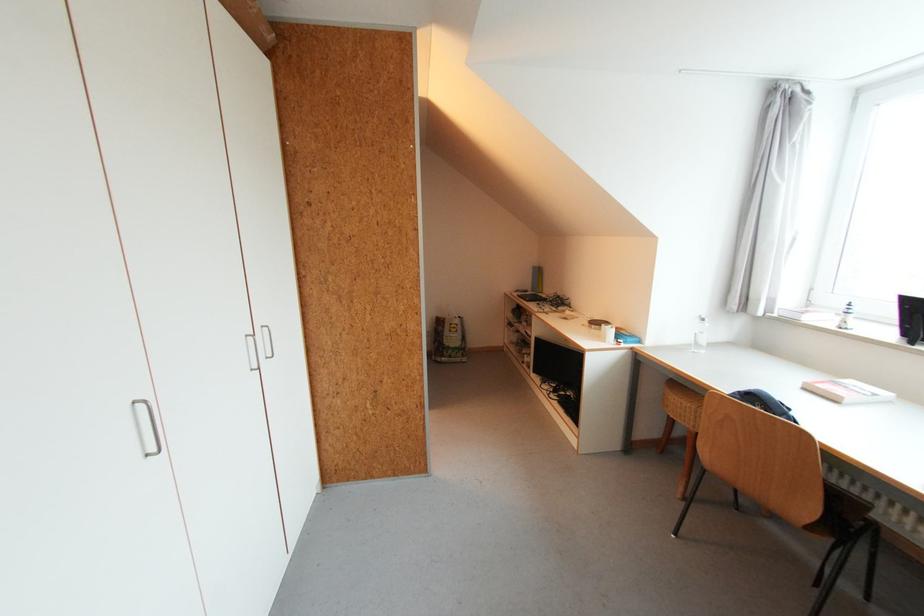
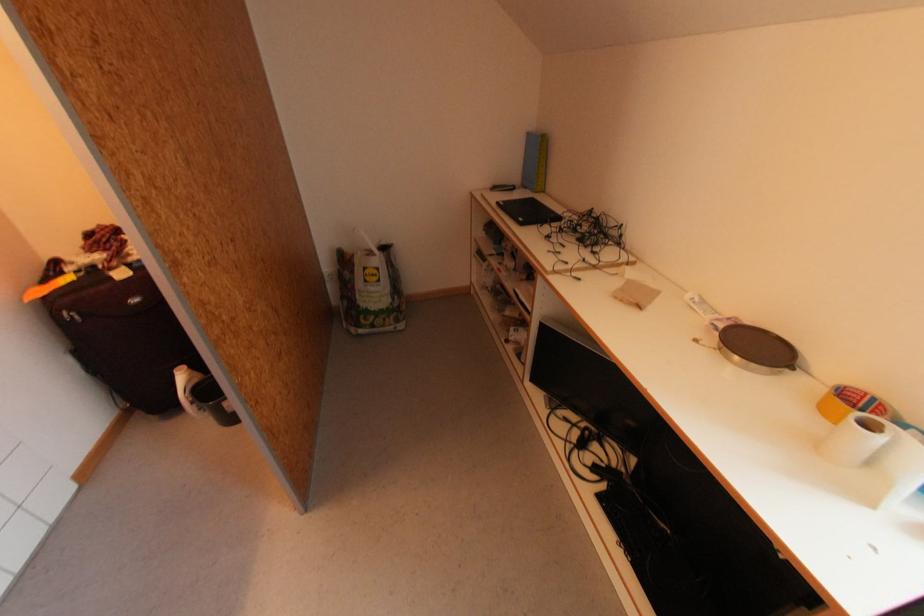
Find the pixel in the second image that matches (x=465, y=318) in the first image.

(390, 249)